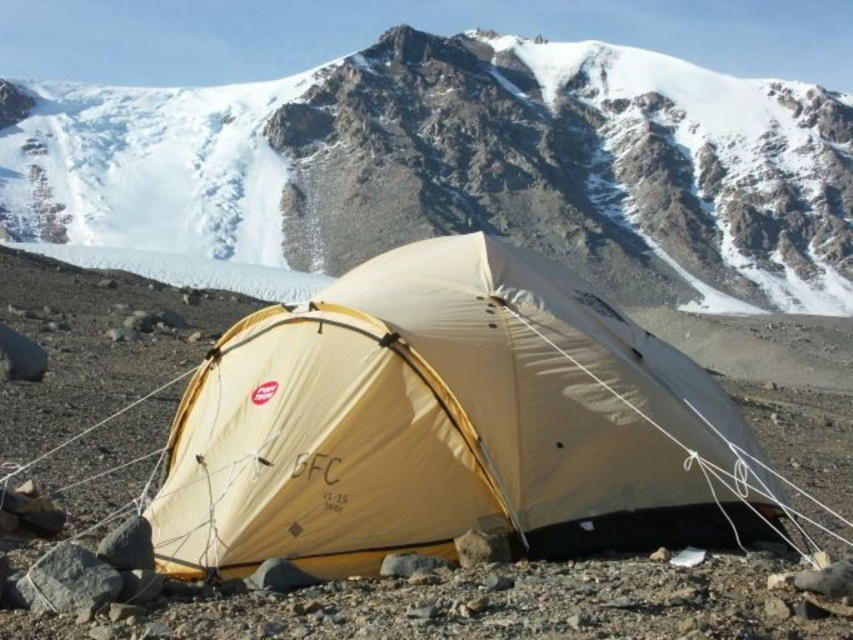
Question: From the image, what is the correct spatial relationship of white matte tent at center in relation to beige nylon tent at center?

Choices:
 (A) left
 (B) right

Answer: (B)

Question: Does white matte tent at center appear on the left side of beige nylon tent at center?

Choices:
 (A) no
 (B) yes

Answer: (A)

Question: Which object is closer to the camera taking this photo?

Choices:
 (A) white matte tent at center
 (B) beige nylon tent at center

Answer: (B)

Question: Observing the image, what is the correct spatial positioning of white matte tent at center in reference to beige nylon tent at center?

Choices:
 (A) right
 (B) left

Answer: (A)